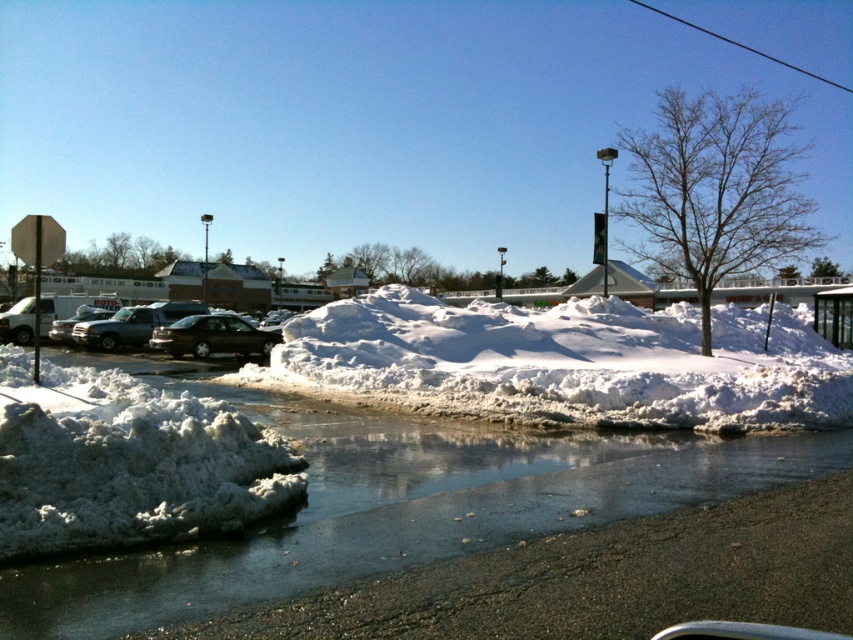
You are standing at the edge of the snowy parking lot and want to park your car near the stop sign on the left. The matte black suv at center is currently blocking the path. Can you drive around it to reach the stop sign area without crossing the wet pavement?

The matte black suv at center is located at point (132, 324). Since the wet pavement is in the foreground and the suv is at the center, you can drive around it either to the left or right, avoiding the wet area to reach the stop sign on the left.

Consider the image. You are standing in the snowy parking lot and notice two points marked on the ground. The first point is at coordinates point (x=138, y=332) and the second is at point (x=59, y=324). Which point is closer to you?

Point (x=138, y=332) is closer to the viewer than point 0.508, 0.70.

From the picture: You are a delivery person trying to navigate through the snowy area. You see two patches of white fluffy snow at center and white fluffy snow at lower left. Which direction should you turn to move from the lower left snow patch towards the center snow patch?

You should turn to your right to move from the white fluffy snow at lower left towards the white fluffy snow at center since the white fluffy snow at center is located to the right of the white fluffy snow at lower left.